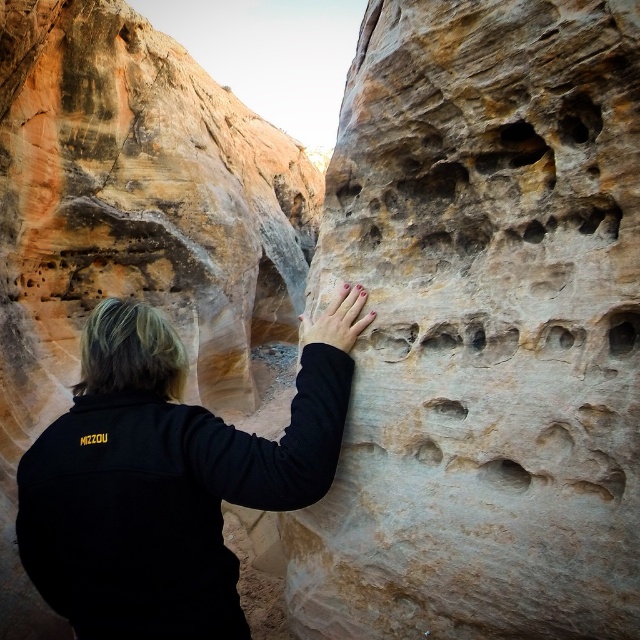
You are a rock climber attempting to navigate through this narrow canyon. You notice two key features here. The rustic stone handhold at center and the smooth beige rock at center. Which of these two features is located above the other?

The smooth beige rock at center is positioned above the rustic stone handhold at center.

You are a hiker trying to climb up the rocky wall. You see a rustic stone handhold at center and a black fleece jacket at center. Which object is positioned to the right side of the other?

The rustic stone handhold at center is to the right of the black fleece jacket at center.